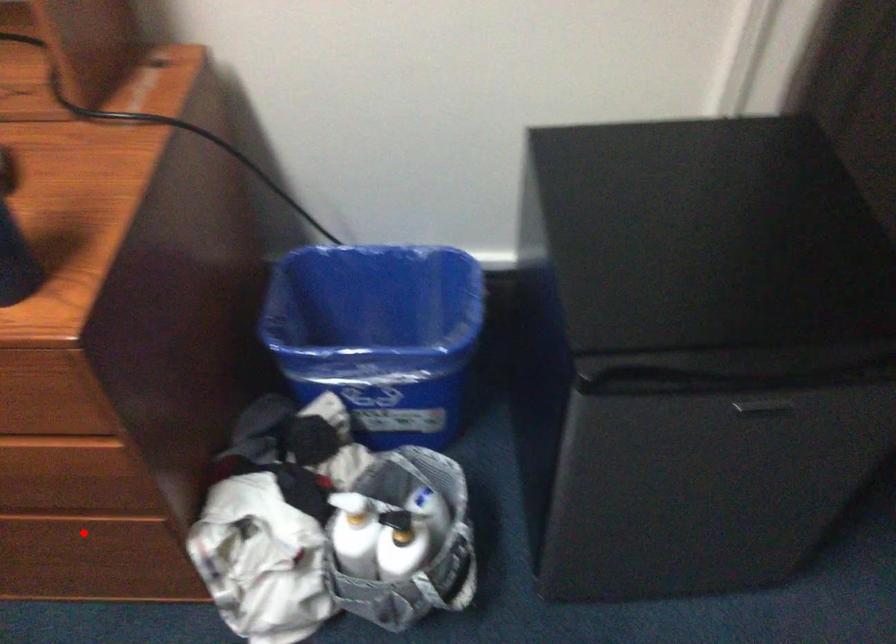
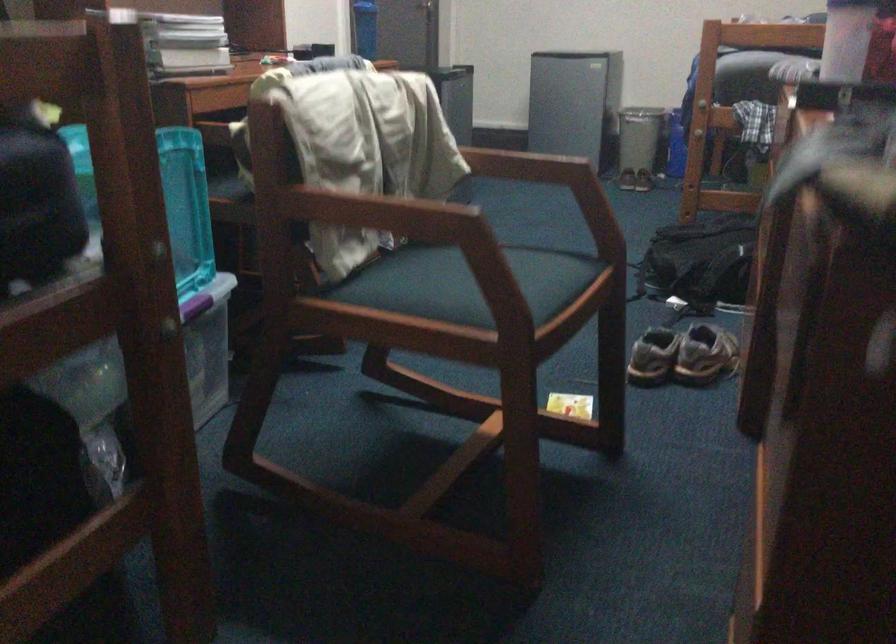
Question: I am providing you with two images of the same scene from different viewpoints. A red point is marked on the first image. Is the red point's position out of view in image 2?

Choices:
 (A) Yes
 (B) No

Answer: (A)